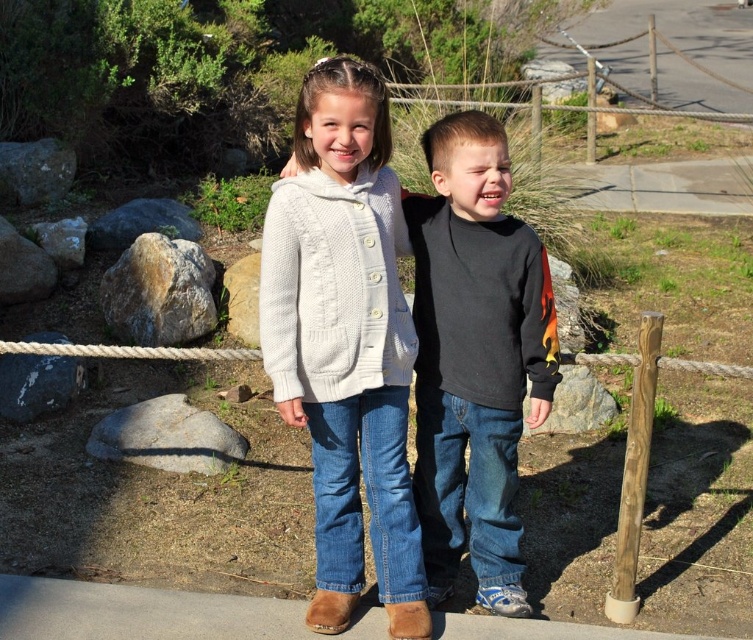
Can you confirm if black matte shirt at center is positioned below white rope at center?

Indeed, black matte shirt at center is positioned under white rope at center.

Who is taller, black matte shirt at center or white rope at center?

black matte shirt at center is taller.

Is point (441, 442) positioned in front of point (156, 355)?

That is True.

The width and height of the screenshot is (753, 640). In order to click on black matte shirt at center in this screenshot , I will do `click(474, 356)`.

Is white knitted cardigan at center behind white rope at center?

No.

Which is behind, point (404, 330) or point (660, 364)?

Point (660, 364)

The image size is (753, 640). Describe the element at coordinates (345, 342) in the screenshot. I see `white knitted cardigan at center` at that location.

You are a GUI agent. You are given a task and a screenshot of the screen. Output one action in this format:
    pyautogui.click(x=<x>, y=<y>)
    Task: Click on the white knitted cardigan at center
    The width and height of the screenshot is (753, 640).
    Given the screenshot: What is the action you would take?
    pyautogui.click(x=345, y=342)

Is white knitted cardigan at center positioned behind brown wooden pole at right?

No.

Which is behind, point (302, 275) or point (608, 611)?

Positioned behind is point (608, 611).

Identify the location of white knitted cardigan at center. (345, 342).